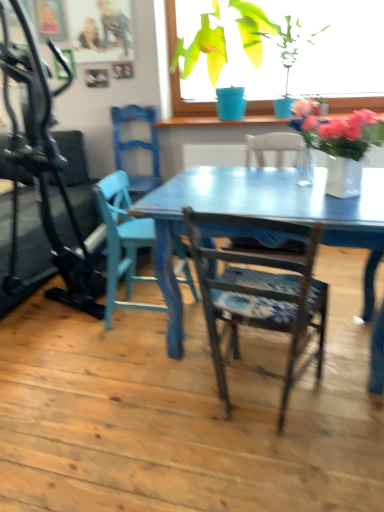
Question: Would you say blue painted wood chair at center, which is the 3th chair in back-to-front order, is outside matte blue chair at left, the first chair viewed from the back?

Choices:
 (A) yes
 (B) no

Answer: (A)

Question: From a real-world perspective, does blue painted wood chair at center, which is the 3th chair in back-to-front order, stand above matte blue chair at left, the first chair viewed from the back?

Choices:
 (A) no
 (B) yes

Answer: (A)

Question: Does blue painted wood chair at center, positioned as the 1th chair in front-to-back order, appear on the right side of matte blue chair at left, the first chair viewed from the back?

Choices:
 (A) no
 (B) yes

Answer: (B)

Question: Is matte blue chair at left, the 3th chair viewed from the front, at the back of blue painted wood chair at center, which is the 3th chair in back-to-front order?

Choices:
 (A) no
 (B) yes

Answer: (A)

Question: Is blue painted wood chair at center, positioned as the 1th chair in front-to-back order, closer to the viewer compared to matte blue chair at left, the first chair viewed from the back?

Choices:
 (A) no
 (B) yes

Answer: (B)

Question: Does blue painted wood chair at center, positioned as the 1th chair in front-to-back order, have a smaller size compared to matte blue chair at left, the first chair viewed from the back?

Choices:
 (A) no
 (B) yes

Answer: (A)

Question: From a real-world perspective, does blue painted wood chair at center, positioned as the 1th chair in front-to-back order, sit lower than black rubber treadmill at left?

Choices:
 (A) no
 (B) yes

Answer: (A)

Question: Can you confirm if blue painted wood chair at center, which is the 3th chair in back-to-front order, is thinner than black rubber treadmill at left?

Choices:
 (A) no
 (B) yes

Answer: (B)

Question: Can you confirm if blue painted wood chair at center, which is the 3th chair in back-to-front order, is positioned to the left of black rubber treadmill at left?

Choices:
 (A) no
 (B) yes

Answer: (A)

Question: Is there a large distance between blue painted wood chair at center, which is the 3th chair in back-to-front order, and black rubber treadmill at left?

Choices:
 (A) yes
 (B) no

Answer: (A)

Question: From the image's perspective, does blue painted wood chair at center, positioned as the 1th chair in front-to-back order, appear higher than black rubber treadmill at left?

Choices:
 (A) yes
 (B) no

Answer: (B)

Question: Is blue painted wood chair at center, which is the 3th chair in back-to-front order, turned away from black rubber treadmill at left?

Choices:
 (A) no
 (B) yes

Answer: (A)

Question: Is green glossy plant at upper center, which is counted as the first houseplant, starting from the right, positioned beyond the bounds of green matte plant pot at upper center, the 1th houseplant from the left?

Choices:
 (A) yes
 (B) no

Answer: (B)